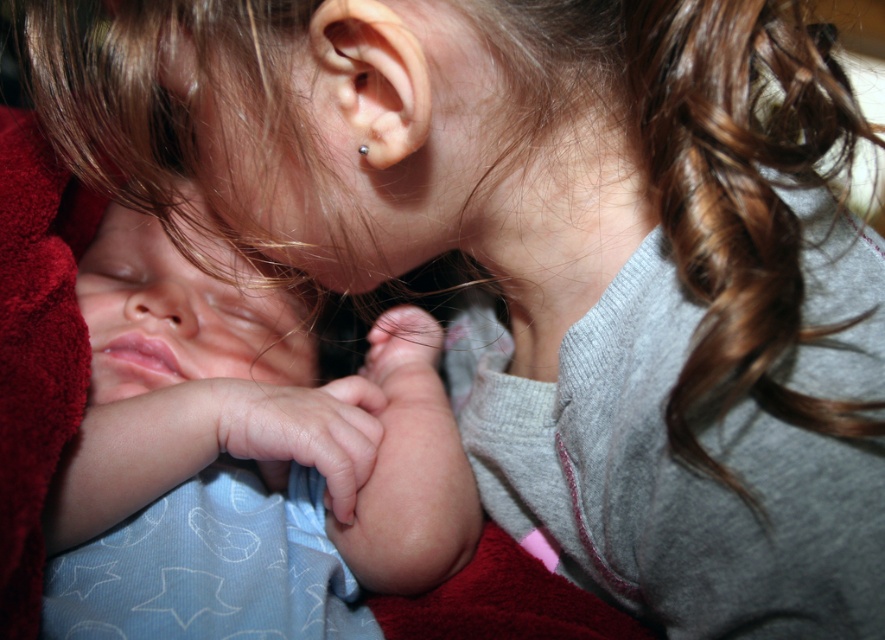
Looking at this image, what is the color of the fabric located at the coordinates point [244,456] in the image?

The fabric at point [244,456] is smooth blue fabric at left.

You are a jeweler examining two silver earrings in the image. The smooth silver earring at upper center and the silver metallic earring at ear. Which one has a larger width?

The smooth silver earring at upper center might be wider than the silver metallic earring at ear according to the description.